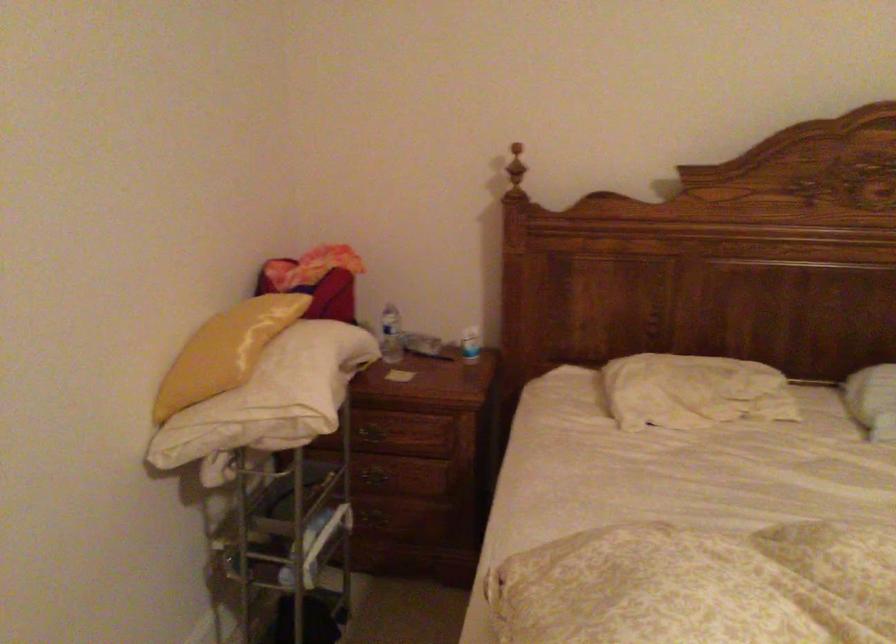
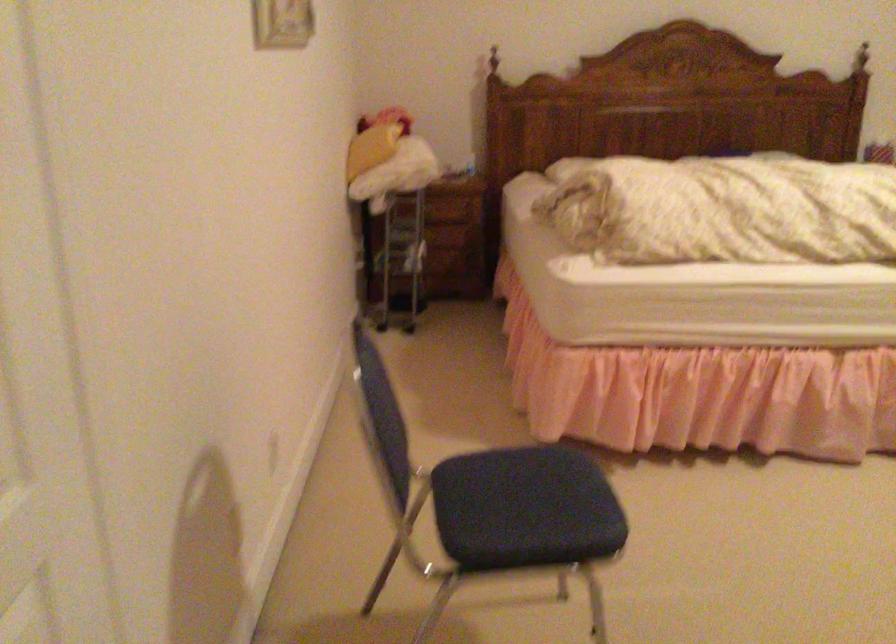
What movement of the cameraman would produce the second image?

The cameraman walked toward left, backward.